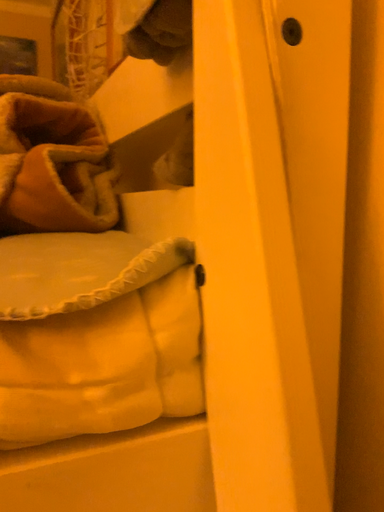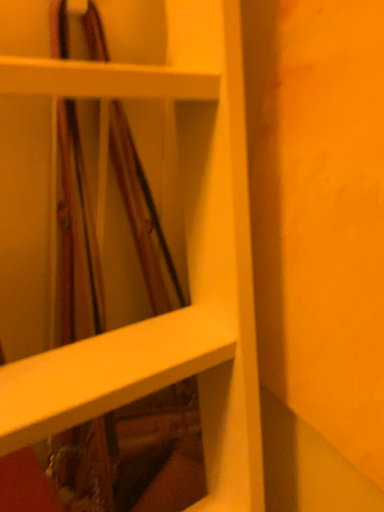
Question: Which way did the camera rotate in the video?

Choices:
 (A) rotated left
 (B) rotated right

Answer: (B)